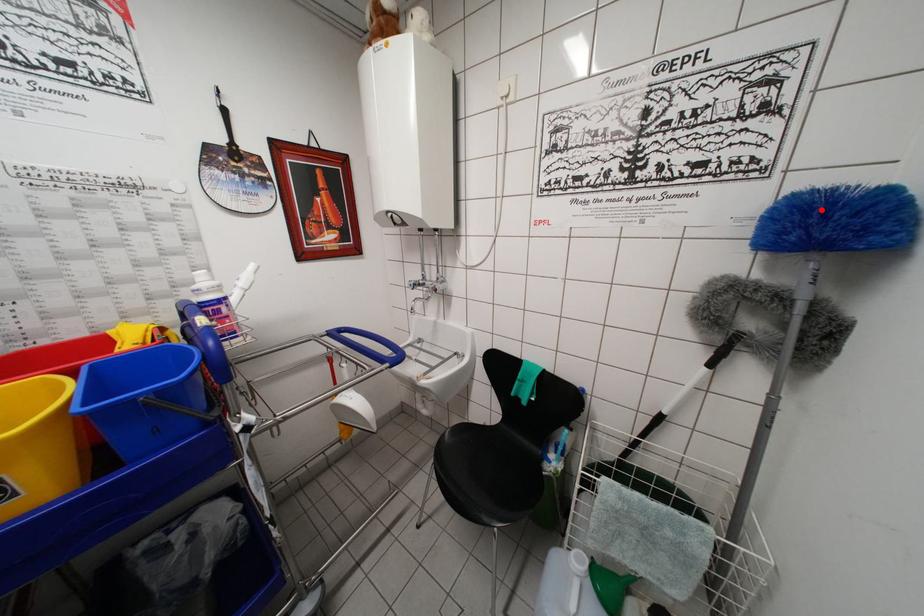
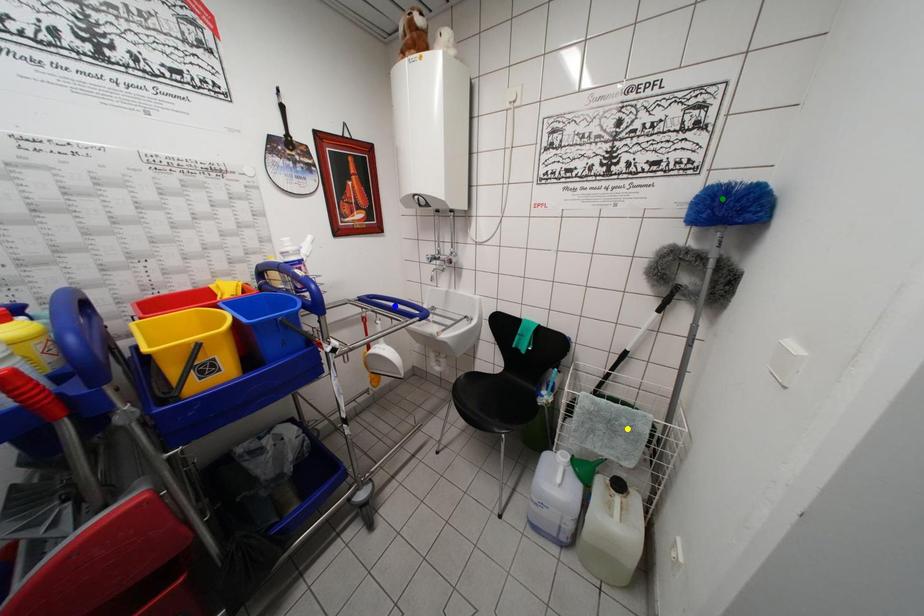
Question: I am providing you with two images of the same scene from different viewpoints. A red point is marked on the first image. You are given multiple points on the second image. Which point in image 2 represents the same 3d spot as the red point in image 1?

Choices:
 (A) green point
 (B) blue point
 (C) yellow point

Answer: (A)